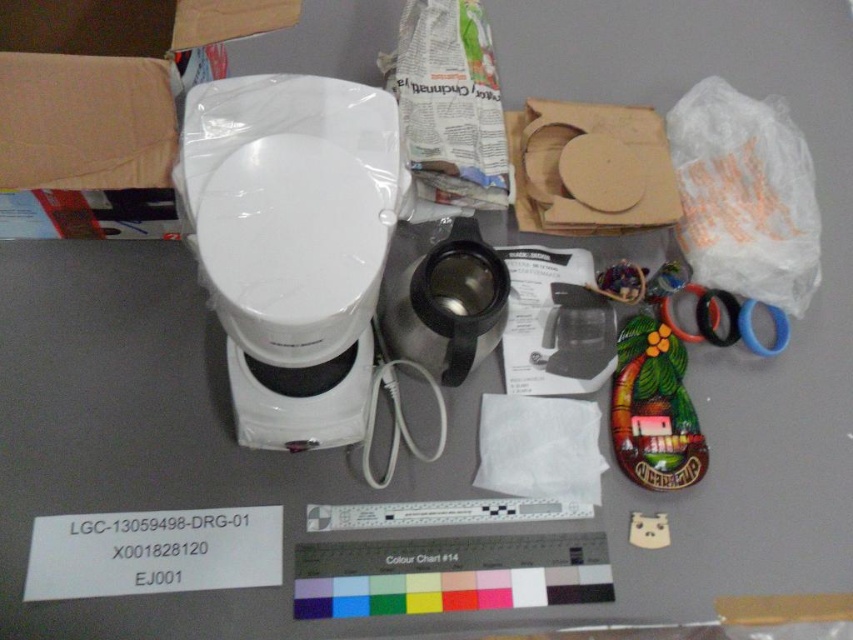
You are a delivery person who just received a package containing the white glossy toilet bowl at center. The package is 60 centimeters wide. Can you fit the package through a doorway that is 65 centimeters wide?

The white glossy toilet bowl at center is 63.23 centimeters wide. Since the package is 60 centimeters wide, it can fit through a doorway that is 65 centimeters wide.

You are organizing items in a bathroom and need to place the white glossy toilet bowl at center and the white matte toilet paper at center. According to the layout, which item should be placed to the right side?

The white matte toilet paper at center should be placed to the right side because the white glossy toilet bowl at center is to the left of it.

Where is the white glossy toilet bowl at center located in the image?

The white glossy toilet bowl at center is located at point (291, 243).